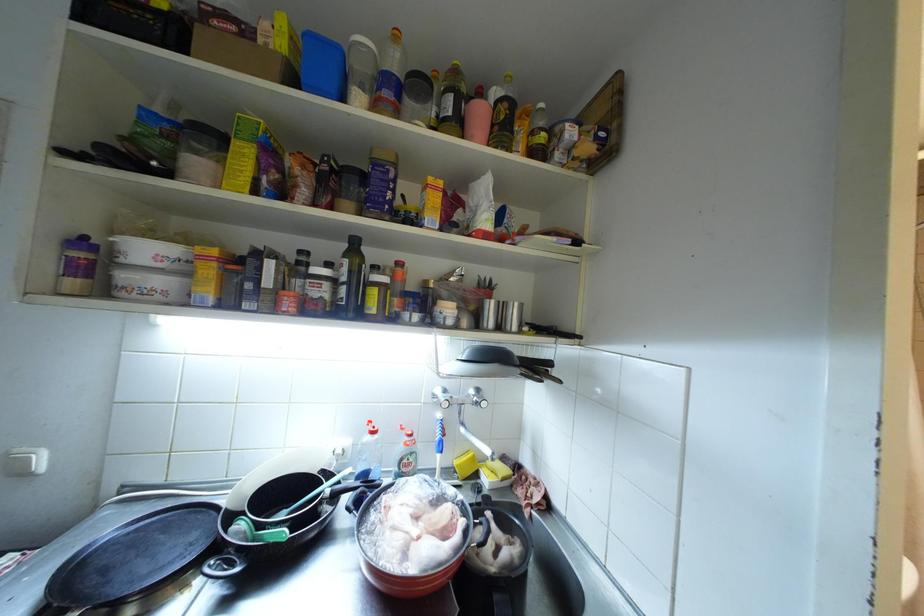
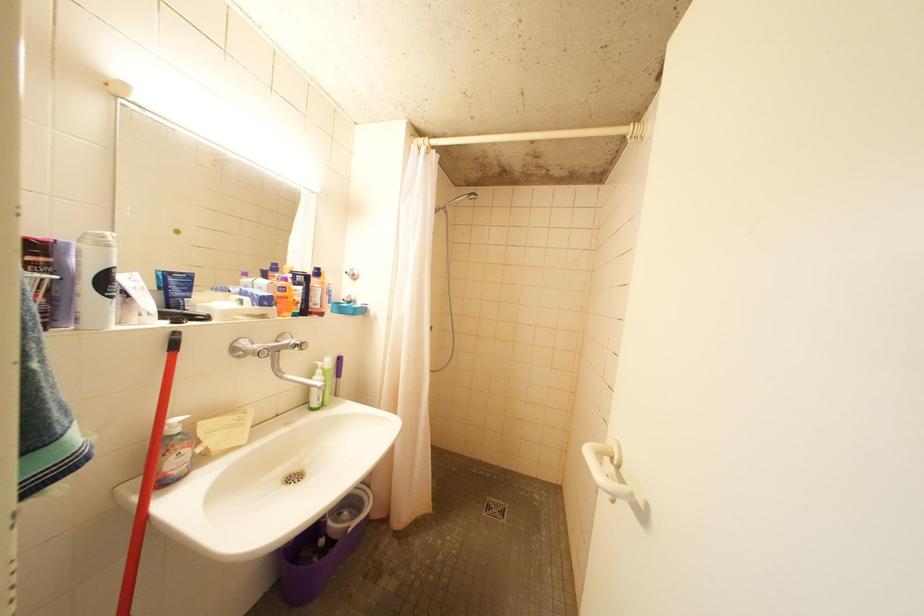
Question: Based on the continuous images, in which direction is the camera rotating? Reply with the corresponding letter.

Choices:
 (A) Left
 (B) Right
 (C) Up
 (D) Down

Answer: (B)